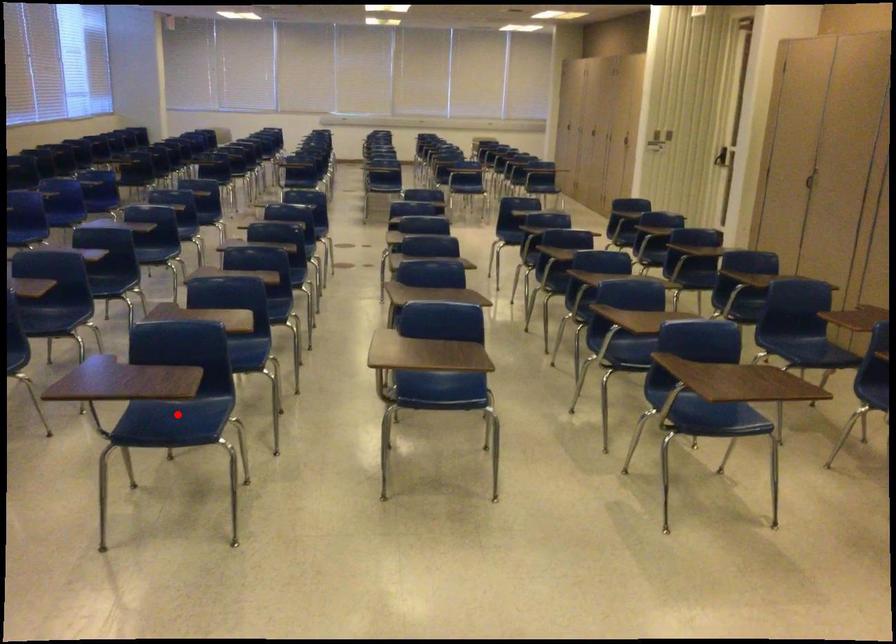
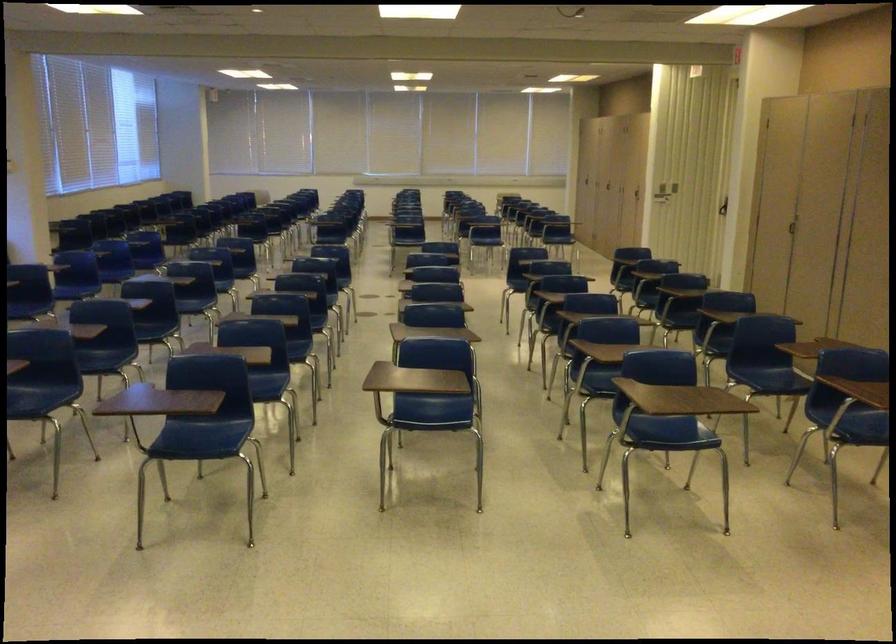
In the second image, find the point that corresponds to the highlighted location in the first image.

(203, 436)